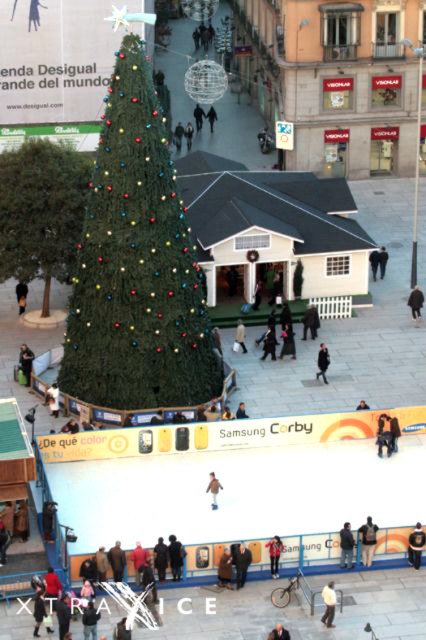
You are a delivery person trying to navigate through the festive square. You need to pass between the white cotton jacket at lower center and the red leather jacket at lower center. If your delivery cart is 1.2 meters wide, can you fit through the space between them?

The white cotton jacket at lower center is narrower than the red leather jacket at lower center. However, the description only provides information about their widths, not the distance between them. Without knowing the actual space between the jackets, it is impossible to determine if the 1.2 meter wide delivery cart can fit through.

You are a visitor at the festive outdoor scene and want to know if you can place your black fabric coat at center next to the green matte christmas tree at center without overlapping. Can you do that?

The green matte christmas tree at center is wider than the black fabric coat at center, so yes, there is enough space to place the black fabric coat at center next to the tree without overlapping.

You are a photographer trying to capture a photo of the festive outdoor scene with the Christmas tree. You have two items in your bag, the dark blue jeans at lower right and the red leather jacket at lower center. Since you want to ensure the items donot block the view of the tree, which item should you place closer to the camera to minimize obstruction?

The red leather jacket at lower center should be placed closer to the camera since it is smaller in size compared to the dark blue jeans at lower right, which is larger. This way, the smaller jacket won